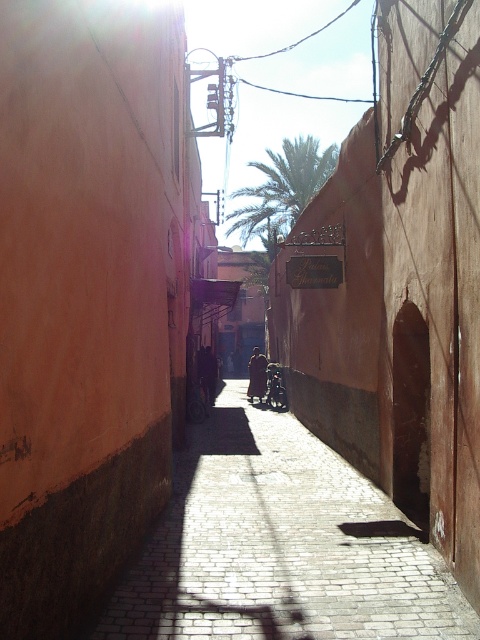
Does brick paved path at center have a greater width compared to green leafy palm tree at upper center?

No.

Can you confirm if brick paved path at center is shorter than green leafy palm tree at upper center?

Yes.

Between point (273, 541) and point (309, 148), which one is positioned in front?

Point (273, 541) is more forward.

Find the location of a particular element. brick paved path at center is located at coordinates (279, 547).

Can you confirm if brick paved path at center is bigger than wooden baby carriage at center?

Yes, brick paved path at center is bigger than wooden baby carriage at center.

Which is in front, point (273, 464) or point (283, 404)?

Positioned in front is point (273, 464).

Between point (339, 582) and point (269, 403), which one is positioned behind?

Positioned behind is point (269, 403).

Locate an element on the screen. brick paved path at center is located at coordinates (279, 547).

Which is more to the right, green leafy palm tree at upper center or wooden baby carriage at center?

From the viewer's perspective, green leafy palm tree at upper center appears more on the right side.

Does point (301, 179) lie behind point (273, 387)?

Yes, it is behind point (273, 387).

Which is in front, point (260, 195) or point (286, 406)?

Point (286, 406)

Where is `green leafy palm tree at upper center`? green leafy palm tree at upper center is located at coordinates (294, 176).